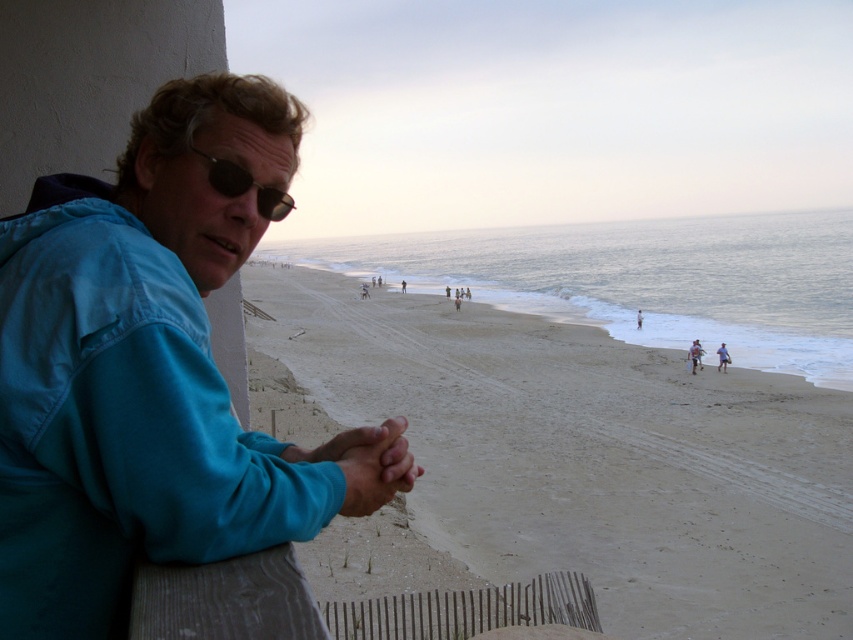
You are a fashion designer analyzing the image. You need to determine which item of clothing or accessory takes up more horizontal space in the scene. Which one is wider between the blue fabric jacket at left and the black reflective sunglasses at upper left?

The blue fabric jacket at left is wider than the black reflective sunglasses at upper left according to the description.

You are standing at the wooden railing where the person in the teal jacket is leaning. If you walk straight ahead towards the beach, will you first encounter the smooth sand beach at center before reaching the point marked at coordinates (590, 456)?

Yes, the smooth sand beach at center is located at the point marked at coordinates (590, 456), so walking straight ahead towards the beach would lead you directly to that point.